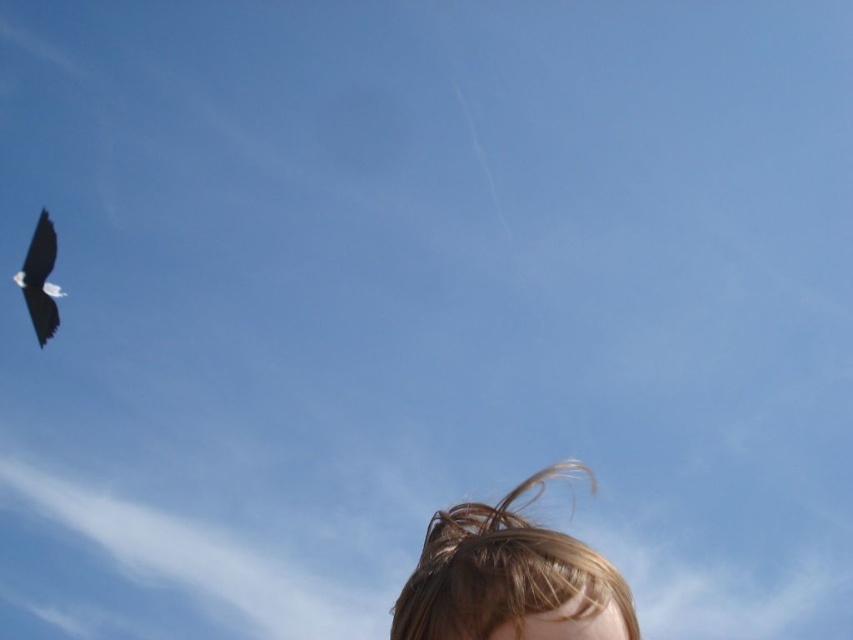
Looking at this image, is the position of blonde hair at lower center more distant than that of black glossy bird at upper left?

No, it is in front of black glossy bird at upper left.

Which is more to the right, blonde hair at lower center or black glossy bird at upper left?

blonde hair at lower center

Who is more forward, (491, 586) or (48, 320)?

Point (491, 586) is in front.

Image resolution: width=853 pixels, height=640 pixels. In order to click on blonde hair at lower center in this screenshot , I will do `click(509, 579)`.